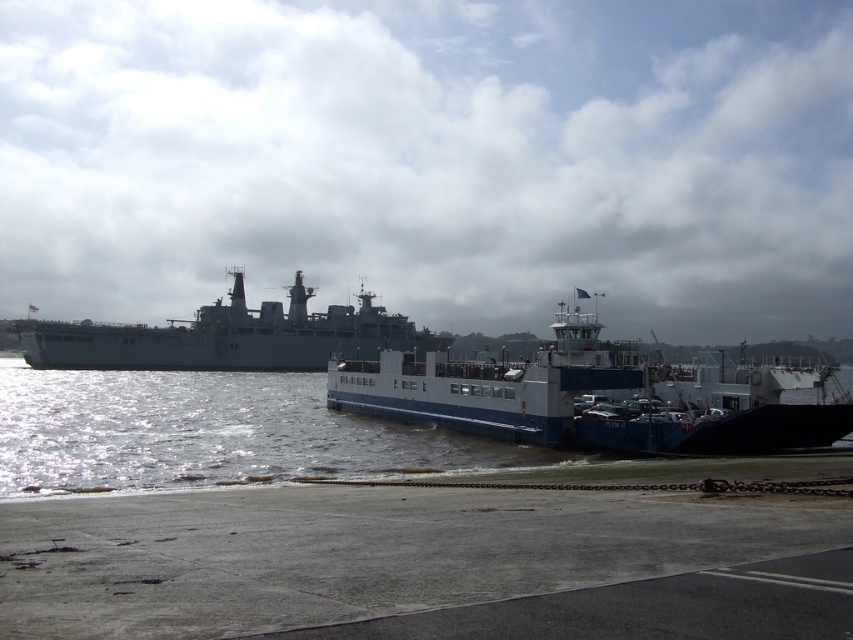
You are a port authority inspector tasked with ensuring safe navigation. You observe the blue matte ferry at center and the gray matte ship at center in the harbor. Based on their positions, which vessel is situated higher in the image?

The blue matte ferry at center is positioned over gray matte ship at center, meaning it is higher in the image.

You are a small boat operator who needs to navigate between the glistening water at lower left and the gray matte ship at center. Given that your boat requires a minimum of 10 meters of space to maneuver safely, can you safely navigate through the area between them?

The distance between the glistening water at lower left and the gray matte ship at center is 12.36 meters, which is greater than the required 10 meters. Therefore, you can safely navigate through the area between them.

You are a sailor who needs to navigate from the glistening water at lower left to the blue matte ferry at center. Based on the scene, which direction should you head to reach the ferry?

The glistening water at lower left is below the blue matte ferry at center, so you should head upwards to reach the ferry.